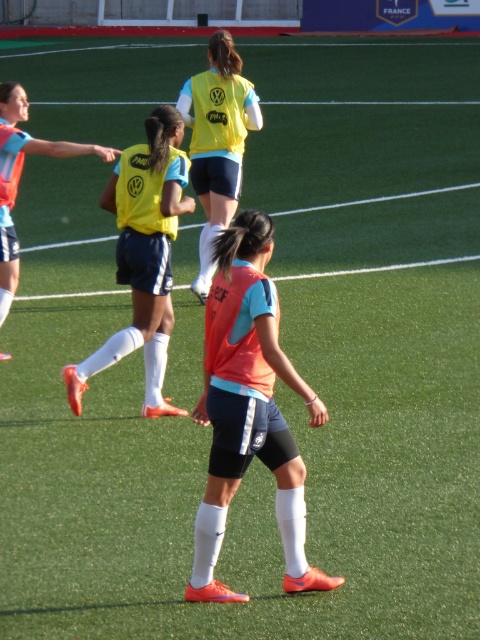
Question: Does orange matte vest at center lie behind yellow matte jersey at center?

Choices:
 (A) yes
 (B) no

Answer: (B)

Question: Where is yellow matte jersey at center located in relation to yellow matte vest at center in the image?

Choices:
 (A) above
 (B) below

Answer: (B)

Question: Which object is closer to the camera taking this photo?

Choices:
 (A) matte orange jersey at left
 (B) orange matte vest at center
 (C) yellow matte jersey at center

Answer: (B)

Question: Which is farther from the matte orange jersey at left?

Choices:
 (A) yellow matte jersey at center
 (B) orange matte vest at center
 (C) yellow matte vest at center

Answer: (B)

Question: Is orange matte vest at center to the right of yellow matte jersey at center from the viewer's perspective?

Choices:
 (A) yes
 (B) no

Answer: (A)

Question: Which object appears farthest from the camera in this image?

Choices:
 (A) yellow matte vest at center
 (B) matte orange jersey at left
 (C) orange matte vest at center
 (D) yellow matte jersey at center

Answer: (A)